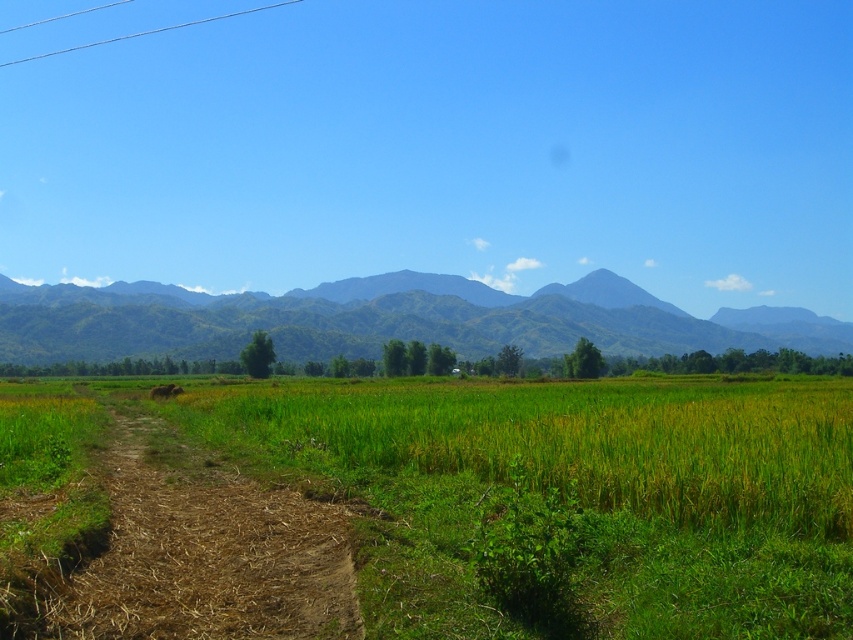
Question: Does green grassy field at center appear on the right side of brown dirt track at lower left?

Choices:
 (A) yes
 (B) no

Answer: (A)

Question: Can you confirm if green grassy field at center is thinner than brown dirt track at lower left?

Choices:
 (A) yes
 (B) no

Answer: (B)

Question: Does green grassy field at center have a smaller size compared to brown dirt track at lower left?

Choices:
 (A) no
 (B) yes

Answer: (A)

Question: Which of the following is the closest to the observer?

Choices:
 (A) green leafy mountain at center
 (B) green grassy field at center
 (C) brown dirt track at lower left

Answer: (B)

Question: Which point is closer to the camera?

Choices:
 (A) green grassy field at center
 (B) brown dirt track at lower left

Answer: (A)

Question: Which point is closer to the camera?

Choices:
 (A) (184, 573)
 (B) (724, 401)

Answer: (A)